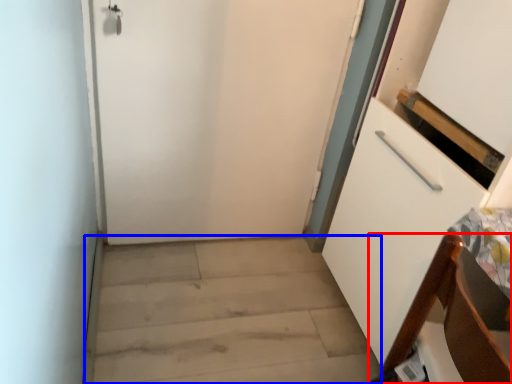
Question: Which object appears farthest to the camera in this image, furniture (highlighted by a red box) or stairwell (highlighted by a blue box)?

Choices:
 (A) furniture
 (B) stairwell

Answer: (B)